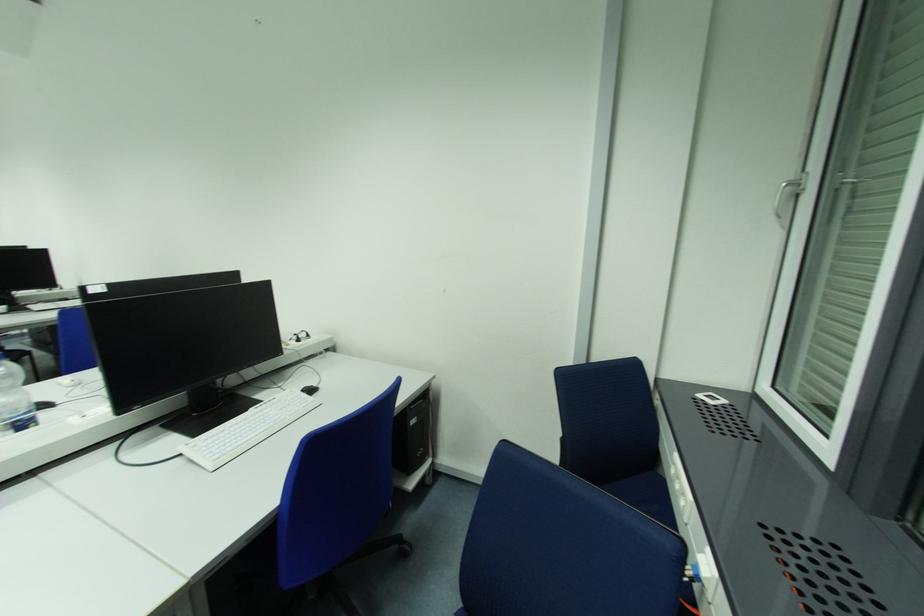
Identify the location of blue chair sitting surface. (639, 488).